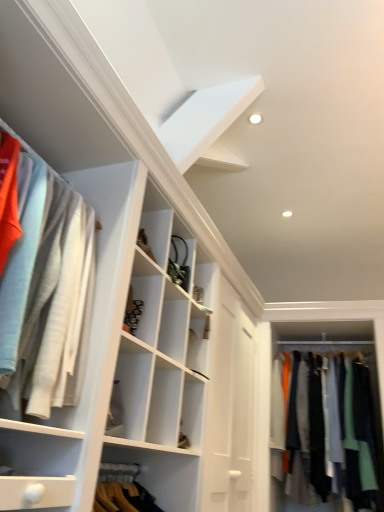
This screenshot has height=512, width=384. I want to click on textured wool sweater at right, so click(x=295, y=503).

What is the approximate width of textured wool sweater at right?

textured wool sweater at right is 24.47 inches wide.

This screenshot has width=384, height=512. Describe the element at coordinates (295, 503) in the screenshot. I see `textured wool sweater at right` at that location.

Measure the distance between point [340,501] and camera.

Point [340,501] and camera are 9.72 feet apart from each other.

This screenshot has width=384, height=512. I want to click on textured wool sweater at right, so click(295, 503).